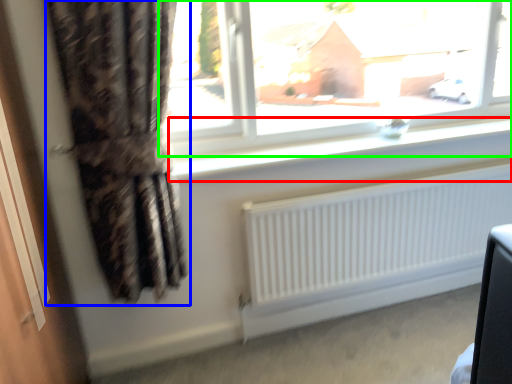
Question: Estimate the real-world distances between objects in this image. Which object is closer to window sill (highlighted by a red box), curtain (highlighted by a blue box) or window (highlighted by a green box)?

Choices:
 (A) curtain
 (B) window

Answer: (A)